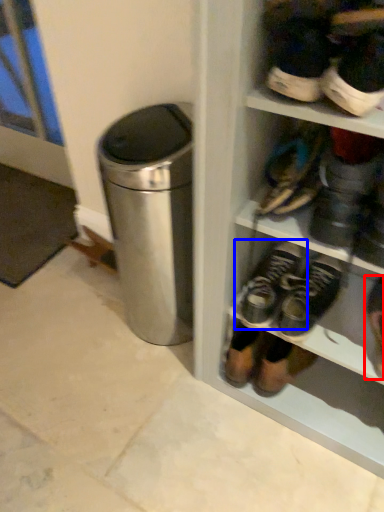
Question: Among these objects, which one is farthest to the camera, footwear (highlighted by a red box) or footwear (highlighted by a blue box)?

Choices:
 (A) footwear
 (B) footwear

Answer: (B)